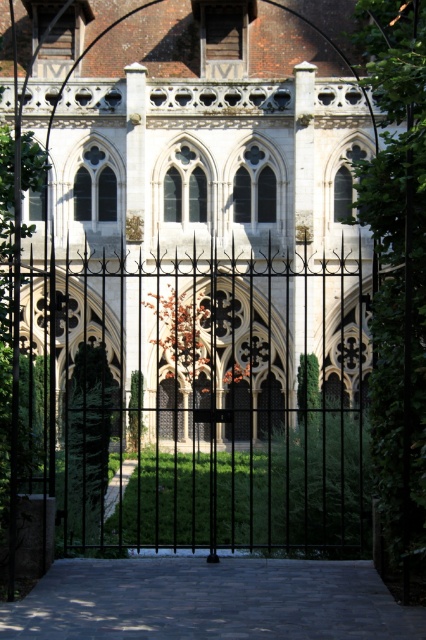
Describe the element at coordinates (199, 202) in the screenshot. I see `white stone church at center` at that location.

Who is positioned more to the left, white stone church at center or black wrought iron gate at center?

From the viewer's perspective, black wrought iron gate at center appears more on the left side.

Where is `white stone church at center`? white stone church at center is located at coordinates (199, 202).